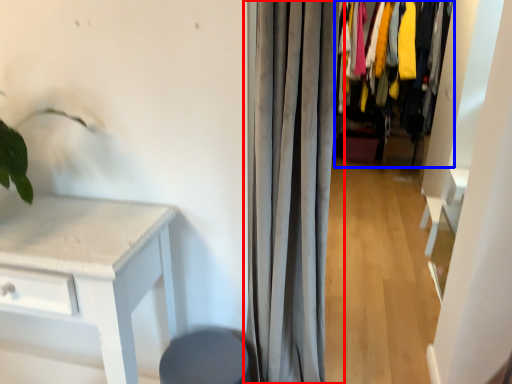
Question: Which of the following is the farthest to the observer, curtain (highlighted by a red box) or closet (highlighted by a blue box)?

Choices:
 (A) curtain
 (B) closet

Answer: (B)